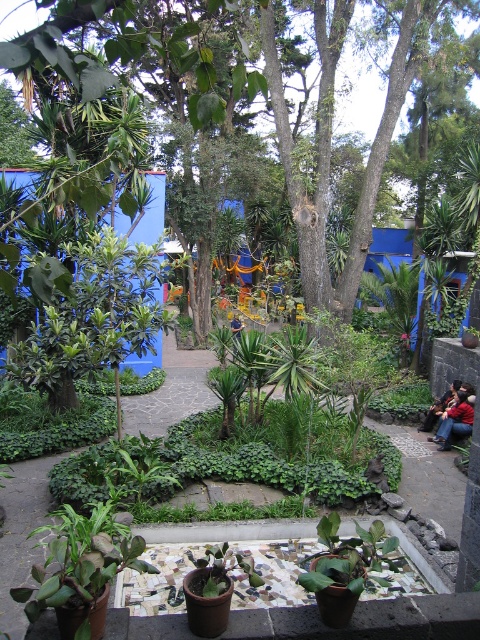
You are a gardener who needs to place a new potted plant in the garden. You have two items in your inventory, the red leather jacket at lower right and the dark blue jeans at lower right. Which item is narrower so you can place it between two shrubs that are only 1.2 meters apart?

The red leather jacket at lower right is narrower than the dark blue jeans at lower right, so it can fit between the two shrubs spaced 1.2 meters apart.

You are a gardener who just arrived at the garden and see the red leather jacket at lower right and dark blue jeans at lower right. You need to hang the jacket on a hook that is 14 inches away from the jeans. Can you place it there?

The red leather jacket at lower right is currently 12.82 inches from the dark blue jeans at lower right. Since the hook needs to be 14 inches away, the jacket would need to be moved slightly further away from the jeans to reach the required distance.

You are standing in the garden and see the red leather jacket at lower right and the dark blue jeans at lower right. Which one is positioned more to the right?

The red leather jacket at lower right is positioned more to the right than the dark blue jeans at lower right.